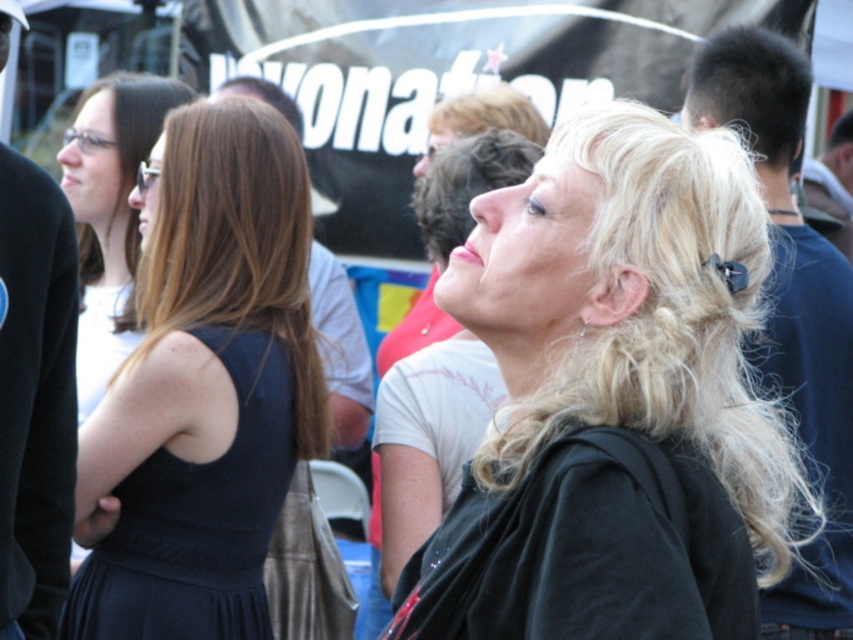
Which is above, black fabric jacket at upper left or matte black shirt at center?

black fabric jacket at upper left is higher up.

Which is behind, point (15, 253) or point (413, 436)?

Point (413, 436)

Between point (62, 371) and point (476, 180), which one is positioned in front?

Point (62, 371) is in front.

You are a GUI agent. You are given a task and a screenshot of the screen. Output one action in this format:
    pyautogui.click(x=<x>, y=<y>)
    Task: Click on the black fabric jacket at upper left
    The height and width of the screenshot is (640, 853).
    Given the screenshot: What is the action you would take?
    pyautogui.click(x=35, y=397)

Does matte black shirt at center appear on the left side of curly blonde hair at upper center?

Indeed, matte black shirt at center is positioned on the left side of curly blonde hair at upper center.

At what (x,y) coordinates should I click in order to perform the action: click on matte black shirt at center. Please return your answer as a coordinate pair (x, y). Looking at the image, I should click on (425, 445).

Where is `matte black shirt at center`? matte black shirt at center is located at coordinates (425, 445).

Does blonde hair at upper right appear over curly blonde hair at upper center?

Indeed, blonde hair at upper right is positioned over curly blonde hair at upper center.

Looking at this image, is blonde hair at upper right taller than curly blonde hair at upper center?

Indeed, blonde hair at upper right has a greater height compared to curly blonde hair at upper center.

Locate an element on the screen. This screenshot has width=853, height=640. blonde hair at upper right is located at coordinates (752, 90).

The height and width of the screenshot is (640, 853). I want to click on blonde hair at upper right, so tap(752, 90).